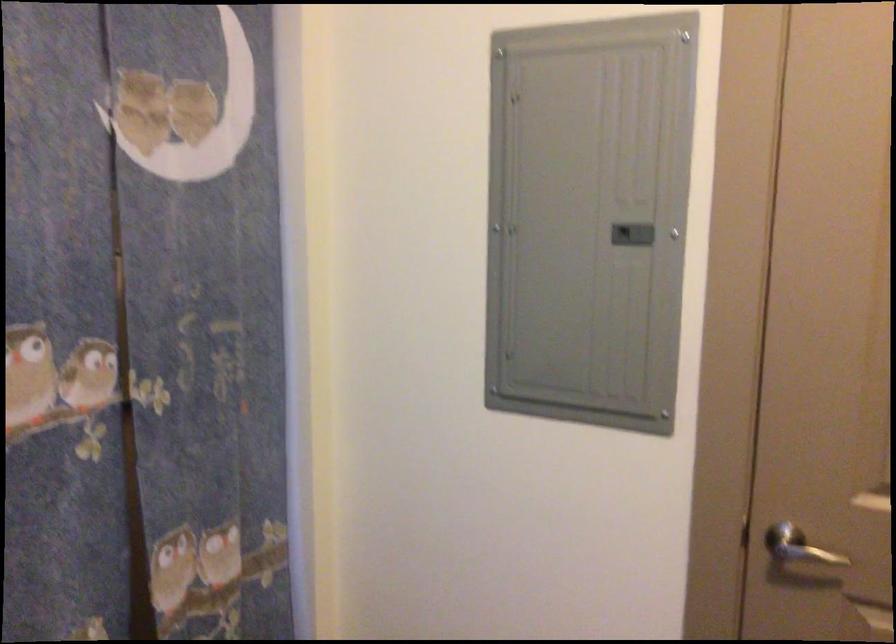
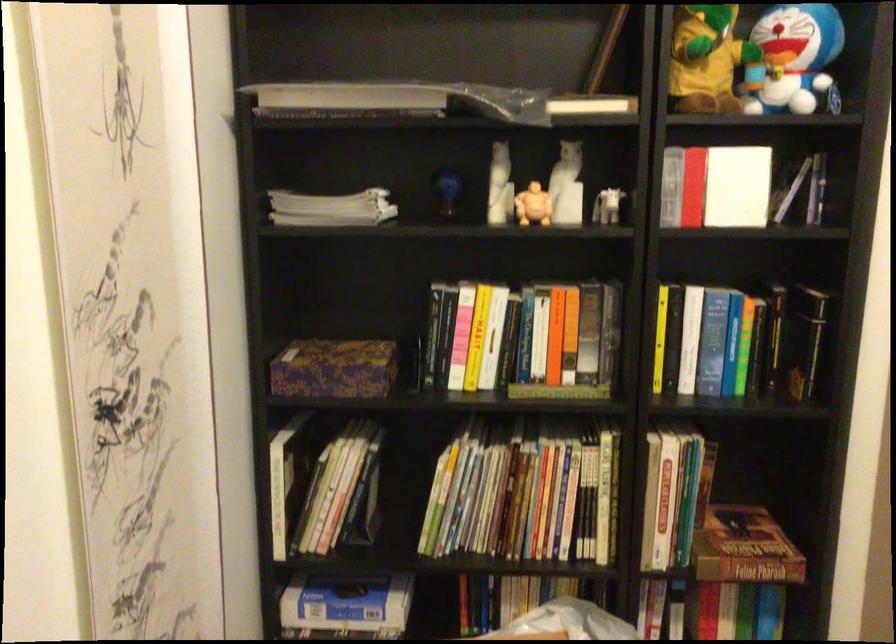
First-person continuous shooting, in which direction is the camera rotating?

The camera's rotation is toward right-down.